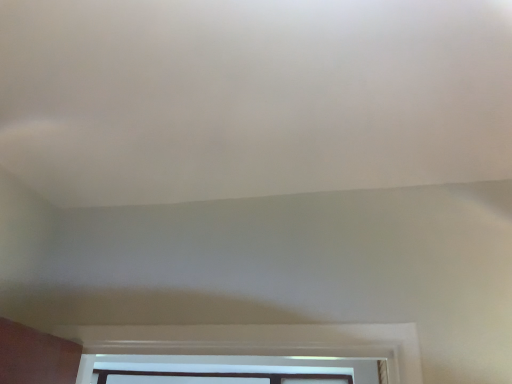
At what (x,y) coordinates should I click in order to perform the action: click on brown wooden frame at bottom. Please return your answer as a coordinate pair (x, y). This screenshot has width=512, height=384. Looking at the image, I should click on (216, 377).

This screenshot has width=512, height=384. What do you see at coordinates (216, 377) in the screenshot?
I see `brown wooden frame at bottom` at bounding box center [216, 377].

You are a GUI agent. You are given a task and a screenshot of the screen. Output one action in this format:
    pyautogui.click(x=<x>, y=<y>)
    Task: Click on the brown wooden frame at bottom
    This screenshot has height=384, width=512.
    Given the screenshot: What is the action you would take?
    pyautogui.click(x=216, y=377)